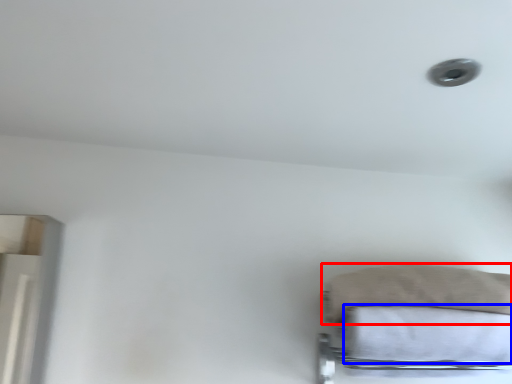
Question: Which of the following is the farthest to the observer, pillow (highlighted by a red box) or sheet (highlighted by a blue box)?

Choices:
 (A) pillow
 (B) sheet

Answer: (A)